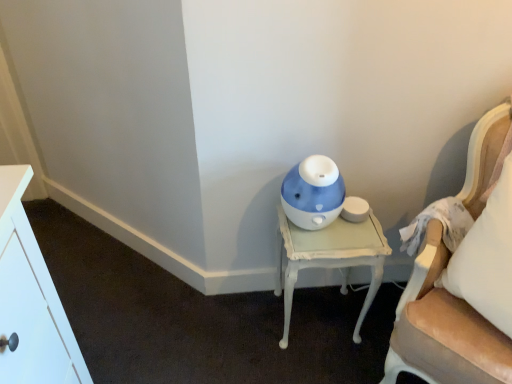
Question: Is blue glossy humidifier at center outside white painted wood nightstand at lower right?

Choices:
 (A) yes
 (B) no

Answer: (A)

Question: Is blue glossy humidifier at center at the left side of white painted wood nightstand at lower right?

Choices:
 (A) no
 (B) yes

Answer: (B)

Question: Does blue glossy humidifier at center contain white painted wood nightstand at lower right?

Choices:
 (A) no
 (B) yes

Answer: (A)

Question: Is blue glossy humidifier at center facing towards white painted wood nightstand at lower right?

Choices:
 (A) yes
 (B) no

Answer: (B)

Question: From the image's perspective, does blue glossy humidifier at center appear lower than white painted wood nightstand at lower right?

Choices:
 (A) no
 (B) yes

Answer: (A)

Question: Is velvet beige chair at right taller or shorter than blue glossy humidifier at center?

Choices:
 (A) short
 (B) tall

Answer: (B)

Question: Looking at their shapes, would you say velvet beige chair at right is wider or thinner than blue glossy humidifier at center?

Choices:
 (A) thin
 (B) wide

Answer: (B)

Question: In terms of size, does velvet beige chair at right appear bigger or smaller than blue glossy humidifier at center?

Choices:
 (A) big
 (B) small

Answer: (A)

Question: From a real-world perspective, is velvet beige chair at right positioned above or below blue glossy humidifier at center?

Choices:
 (A) above
 (B) below

Answer: (A)

Question: Is velvet beige chair at right taller or shorter than white painted wood nightstand at lower right?

Choices:
 (A) short
 (B) tall

Answer: (B)

Question: From the image's perspective, relative to white painted wood nightstand at lower right, is velvet beige chair at right above or below?

Choices:
 (A) below
 (B) above

Answer: (B)

Question: Looking at their shapes, would you say velvet beige chair at right is wider or thinner than white painted wood nightstand at lower right?

Choices:
 (A) wide
 (B) thin

Answer: (A)

Question: Visually, is velvet beige chair at right positioned to the left or to the right of white painted wood nightstand at lower right?

Choices:
 (A) left
 (B) right

Answer: (B)

Question: Would you say white painted wood nightstand at lower right is inside or outside blue glossy humidifier at center?

Choices:
 (A) outside
 (B) inside

Answer: (A)

Question: Considering the positions of point (287, 312) and point (310, 221), is point (287, 312) closer or farther from the camera than point (310, 221)?

Choices:
 (A) farther
 (B) closer

Answer: (A)